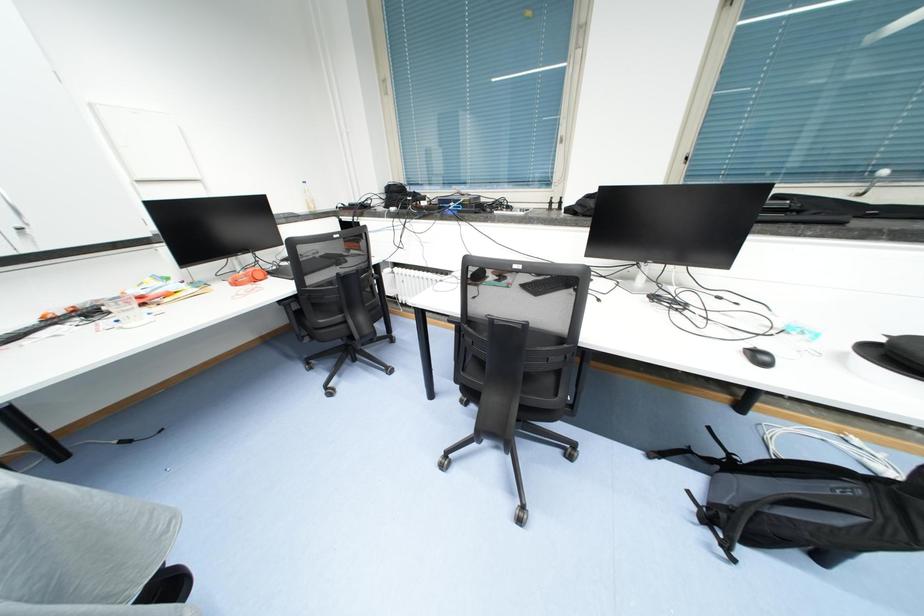
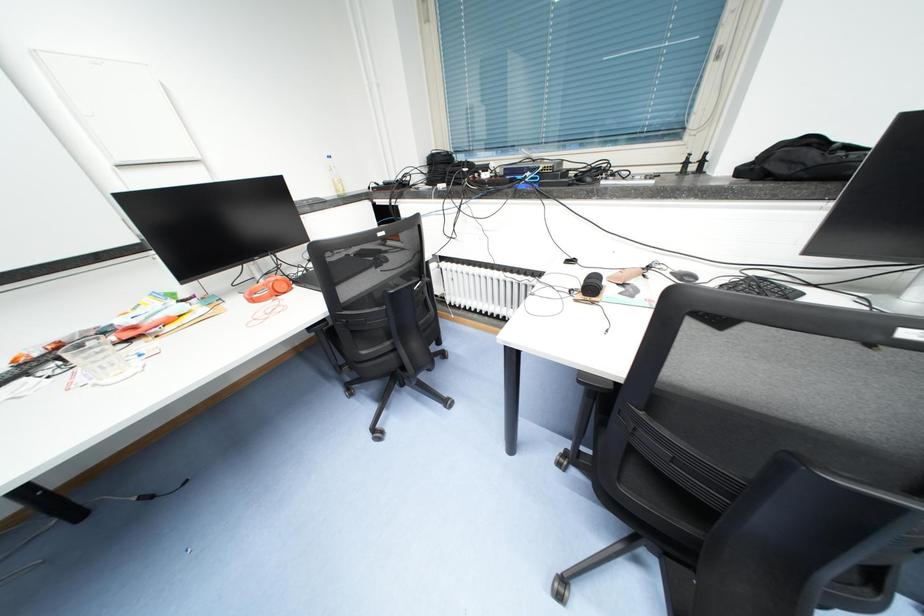
The images are taken continuously from a first-person perspective. In which direction are you moving?

The cameraman walked toward left, forward.